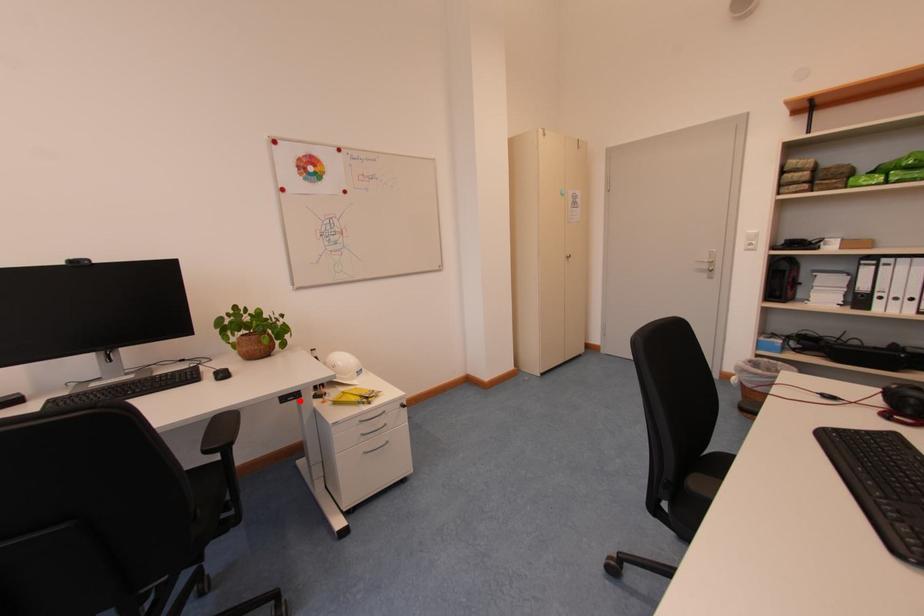
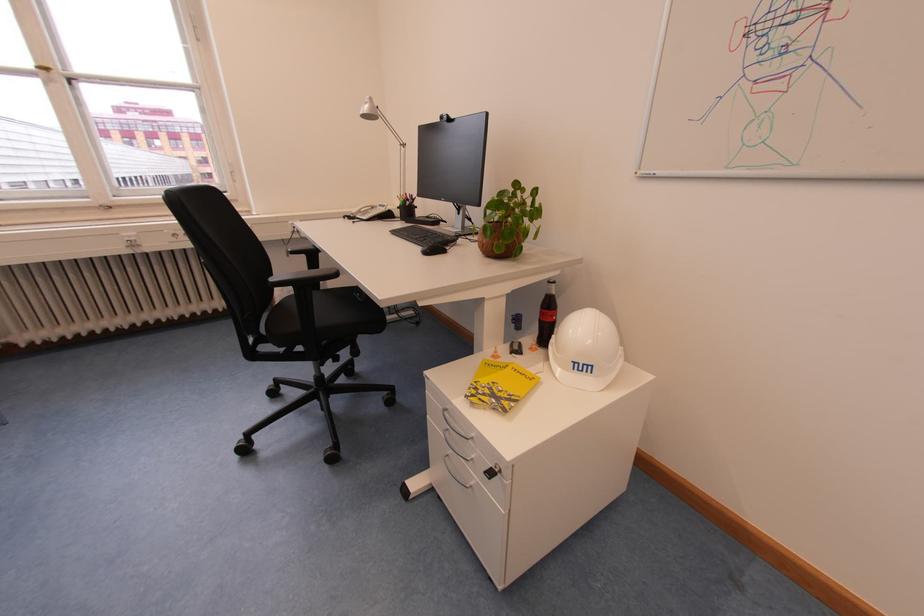
The point at the highlighted location is marked in the first image. Where is the corresponding point in the second image?

(367, 298)